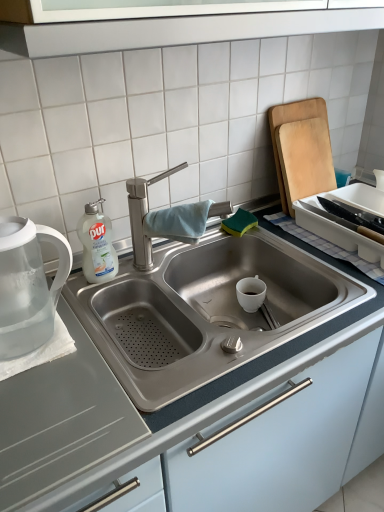
What is the approximate height of white liquid soap at left?

8.83 inches.

This screenshot has width=384, height=512. In order to click on white liquid soap at left in this screenshot , I will do [97, 244].

What do you see at coordinates (143, 215) in the screenshot? I see `brushed metal tap at center` at bounding box center [143, 215].

Find the location of a particular element. The image size is (384, 512). transparent plastic tea pot at left is located at coordinates click(28, 285).

Locate an element on the screen. This screenshot has width=384, height=512. wooden cutting board at right is located at coordinates (301, 150).

Between white plastic tray at upper right and white liquid soap at left, which one has more height?

Standing taller between the two is white liquid soap at left.

Is the surface of white plastic tray at upper right in direct contact with white liquid soap at left?

They are not placed beside each other.

Considering the positions of objects white plastic tray at upper right and white liquid soap at left in the image provided, who is behind, white plastic tray at upper right or white liquid soap at left?

white plastic tray at upper right is further away from the camera.

Is white plastic tray at upper right positioned beyond the bounds of white liquid soap at left?

That's correct, white plastic tray at upper right is outside of white liquid soap at left.

From their relative heights in the image, would you say white liquid soap at left is taller or shorter than satin steel sink at center?

white liquid soap at left is shorter than satin steel sink at center.

Does white liquid soap at left have a larger size compared to satin steel sink at center?

Incorrect, white liquid soap at left is not larger than satin steel sink at center.

Are white liquid soap at left and satin steel sink at center far apart?

No, white liquid soap at left is not far away from satin steel sink at center.

Considering the positions of objects white liquid soap at left and satin steel sink at center in the image provided, who is more to the right, white liquid soap at left or satin steel sink at center?

Positioned to the right is satin steel sink at center.

Is satin steel sink at center far from white liquid soap at left?

No, there isn't a large distance between satin steel sink at center and white liquid soap at left.

From the picture: Considering the relative positions of satin steel sink at center and white liquid soap at left in the image provided, is satin steel sink at center behind white liquid soap at left?

No, the depth of satin steel sink at center is less than that of white liquid soap at left.

Does satin steel sink at center contain white liquid soap at left?

Actually, white liquid soap at left is outside satin steel sink at center.

Can you confirm if white liquid soap at left is bigger than transparent plastic tea pot at left?

Incorrect, white liquid soap at left is not larger than transparent plastic tea pot at left.

From a real-world perspective, is white liquid soap at left physically located above or below transparent plastic tea pot at left?

Clearly, from a real-world perspective, white liquid soap at left is below transparent plastic tea pot at left.

Is white liquid soap at left situated inside transparent plastic tea pot at left or outside?

white liquid soap at left cannot be found inside transparent plastic tea pot at left.

From the image's perspective, does white liquid soap at left appear lower than transparent plastic tea pot at left?

No, from the image's perspective, white liquid soap at left is not below transparent plastic tea pot at left.

Does point (118, 378) appear closer or farther from the camera than point (1, 247)?

Point (118, 378) is farther from the camera than point (1, 247).

Does satin steel sink at center lie in front of transparent plastic tea pot at left?

Yes, satin steel sink at center is closer to the camera.

This screenshot has width=384, height=512. I want to click on tea pot on the left of satin steel sink at center, so click(28, 285).

Considering the sizes of objects satin steel sink at center and transparent plastic tea pot at left in the image provided, who is thinner, satin steel sink at center or transparent plastic tea pot at left?

transparent plastic tea pot at left.

Between white liquid soap at left and brushed metal tap at center, which one has smaller size?

white liquid soap at left.

Is white liquid soap at left positioned far away from brushed metal tap at center?

white liquid soap at left is actually quite close to brushed metal tap at center.

Is white liquid soap at left facing towards brushed metal tap at center?

No, white liquid soap at left is not oriented towards brushed metal tap at center.

Does white liquid soap at left lie behind brushed metal tap at center?

Yes.

Which point is more forward, (301, 207) or (308, 131)?

Positioned in front is point (301, 207).

Is white plastic tray at upper right smaller than wooden cutting board at right?

Actually, white plastic tray at upper right might be larger than wooden cutting board at right.

Measure the distance from white plastic tray at upper right to wooden cutting board at right.

6.26 inches.

From a real-world perspective, is white plastic tray at upper right physically above wooden cutting board at right?

Actually, white plastic tray at upper right is physically below wooden cutting board at right in the real world.

Locate an element on the screen. cleaning product below the white plastic tray at upper right (from the image's perspective) is located at coordinates (97, 244).

What are the coordinates of `cleaning product lying behind the satin steel sink at center` in the screenshot? It's located at (97, 244).

Consider the image. Looking at the image, which one is located further to brushed metal tap at center, white liquid soap at left or satin steel sink at center?

satin steel sink at center.

Estimate the real-world distances between objects in this image. Which object is further from wooden cutting board at right, white plastic tray at upper right or satin steel sink at center?

satin steel sink at center is further to wooden cutting board at right.

From the image, which object appears to be farther from wooden cutting board at right, brushed metal tap at center or white liquid soap at left?

white liquid soap at left lies further to wooden cutting board at right than the other object.

When comparing their distances from wooden cutting board at right, does transparent plastic tea pot at left or satin steel sink at center seem closer?

satin steel sink at center.

Based on their spatial positions, is white plastic tray at upper right or satin steel sink at center closer to white liquid soap at left?

satin steel sink at center is closer to white liquid soap at left.

Based on their spatial positions, is satin steel sink at center or transparent plastic tea pot at left further from brushed metal tap at center?

satin steel sink at center lies further to brushed metal tap at center than the other object.

Considering their positions, is white plastic tray at upper right positioned further to transparent plastic tea pot at left than white liquid soap at left?

Among the two, white plastic tray at upper right is located further to transparent plastic tea pot at left.

Estimate the real-world distances between objects in this image. Which object is closer to transparent plastic tea pot at left, wooden cutting board at right or white liquid soap at left?

white liquid soap at left.

At what (x,y) coordinates should I click in order to perform the action: click on tap situated between white liquid soap at left and wooden cutting board at right from left to right. Please return your answer as a coordinate pair (x, y). Looking at the image, I should click on coord(143,215).

Locate an element on the screen. The image size is (384, 512). appliance that lies between wooden cutting board at right and satin steel sink at center from top to bottom is located at coordinates (339, 234).

I want to click on tap between transparent plastic tea pot at left and white liquid soap at left along the z-axis, so click(143, 215).

Where is `countertop between white liquid soap at left and white plastic tray at upper right`? The image size is (384, 512). countertop between white liquid soap at left and white plastic tray at upper right is located at coordinates (195, 390).